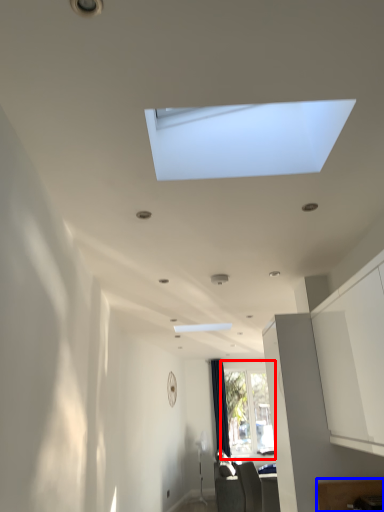
Question: Which object appears farthest to the camera in this image, window (highlighted by a red box) or furniture (highlighted by a blue box)?

Choices:
 (A) window
 (B) furniture

Answer: (A)